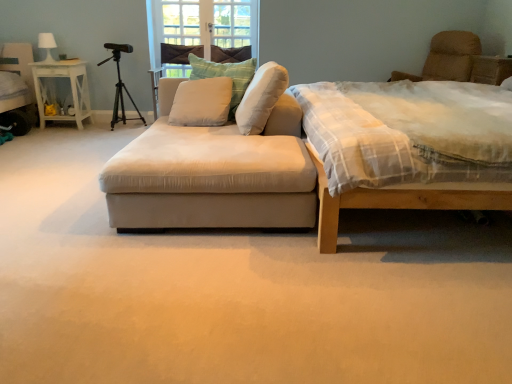
At what (x,y) coordinates should I click in order to perform the action: click on vacant area that is in front of beige fabric studio couch at center. Please return your answer as a coordinate pair (x, y). This screenshot has height=384, width=512. Looking at the image, I should click on (193, 290).